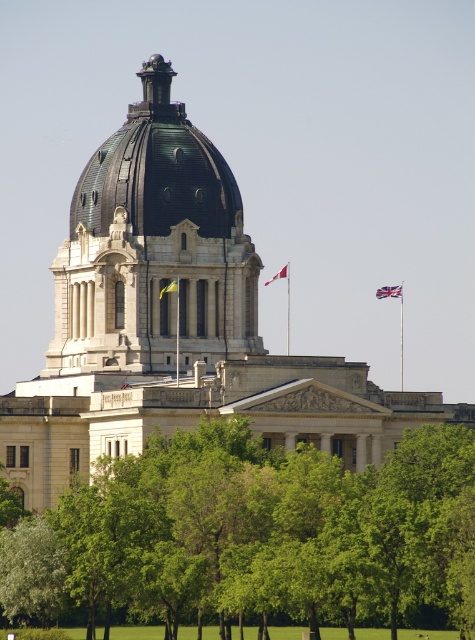
You are standing at a point where the distance to the point marked as point (237, 208) is 147.61 meters. You want to take a photo of the grand architectural structure with the dome. Will the entire building fit in your camera view if your camera has a 60 degree field of view?

The distance between you and the point marked as point (237, 208) is 147.61 meters. To determine if the entire building fits in the camera view with a 60 degree field of view, we need to calculate the building dimensions. However, the provided information does not include the building width or height. Without this data, it is impossible to confirm if the entire structure will fit within the camera view.

You are standing in front of the government building and want to determine the relative positions of two points marked on the facade. Based on the image, which of the two points, point (288, 269) or point (161, 296), is closer to you?

Point (161, 296) is closer to you because it is less further to the camera than point (288, 269).

You are standing in front of the government building and want to take a photo of both the green copper dome at upper center and the british flag at upper right. However, your camera can only focus on objects within a certain height range. The flag is at a lower height than the dome. Which object should you adjust your camera focus to prioritize if you want to ensure both are in focus?

The green copper dome at upper center is taller than the british flag at upper right. To ensure both are in focus, prioritize focusing on the green copper dome at upper center since it is taller and the flag is lower, so adjusting focus to accommodate the dome will likely include the flag within the focus range.